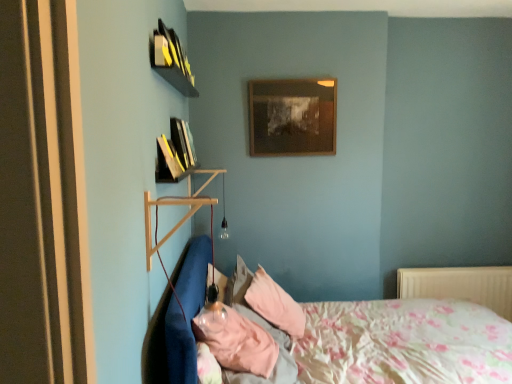
Question: Is wooden picture frame at upper center further to camera compared to floral fabric bed at lower right?

Choices:
 (A) no
 (B) yes

Answer: (B)

Question: Can you confirm if wooden picture frame at upper center is positioned to the right of floral fabric bed at lower right?

Choices:
 (A) no
 (B) yes

Answer: (A)

Question: Does wooden picture frame at upper center have a greater height compared to floral fabric bed at lower right?

Choices:
 (A) no
 (B) yes

Answer: (A)

Question: Would you say wooden picture frame at upper center is a long distance from floral fabric bed at lower right?

Choices:
 (A) no
 (B) yes

Answer: (B)

Question: Is wooden picture frame at upper center placed right next to floral fabric bed at lower right?

Choices:
 (A) no
 (B) yes

Answer: (A)

Question: Considering the positions of hardcover book at upper left, placed as the 2th book when sorted from front to back, and wooden picture frame at upper center in the image, is hardcover book at upper left, placed as the 2th book when sorted from front to back, taller or shorter than wooden picture frame at upper center?

Choices:
 (A) tall
 (B) short

Answer: (B)

Question: Is hardcover book at upper left, which ranks as the 1th book in back-to-front order, wider or thinner than wooden picture frame at upper center?

Choices:
 (A) wide
 (B) thin

Answer: (A)

Question: Is point (162, 168) positioned closer to the camera than point (286, 147)?

Choices:
 (A) closer
 (B) farther

Answer: (A)

Question: Based on their sizes in the image, would you say hardcover book at upper left, which ranks as the 1th book in back-to-front order, is bigger or smaller than wooden picture frame at upper center?

Choices:
 (A) small
 (B) big

Answer: (A)

Question: Is hardcover book at upper left, which ranks as the 1th book in back-to-front order, inside or outside of white plastic radiator at lower right?

Choices:
 (A) outside
 (B) inside

Answer: (A)

Question: From a real-world perspective, is hardcover book at upper left, which ranks as the 1th book in back-to-front order, physically located above or below white plastic radiator at lower right?

Choices:
 (A) below
 (B) above

Answer: (B)

Question: Considering the positions of hardcover book at upper left, placed as the 2th book when sorted from front to back, and white plastic radiator at lower right in the image, is hardcover book at upper left, placed as the 2th book when sorted from front to back, wider or thinner than white plastic radiator at lower right?

Choices:
 (A) thin
 (B) wide

Answer: (A)

Question: Is hardcover book at upper left, which ranks as the 1th book in back-to-front order, to the left or to the right of white plastic radiator at lower right in the image?

Choices:
 (A) left
 (B) right

Answer: (A)

Question: Is white plastic radiator at lower right spatially inside pink fabric pillow at lower center, or outside of it?

Choices:
 (A) outside
 (B) inside

Answer: (A)

Question: From a real-world perspective, is white plastic radiator at lower right above or below pink fabric pillow at lower center?

Choices:
 (A) above
 (B) below

Answer: (B)